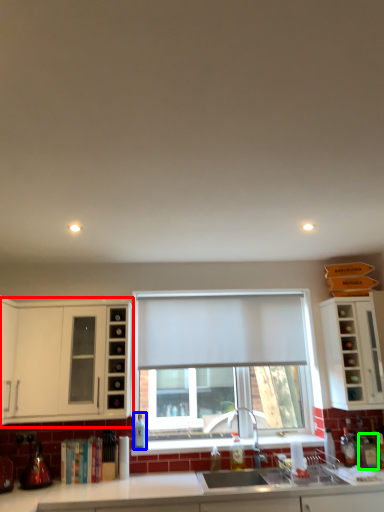
Question: Estimate the real-world distances between objects in this image. Which object is closer to cabinetry (highlighted by a red box), bottle (highlighted by a blue box) or bottle (highlighted by a green box)?

Choices:
 (A) bottle
 (B) bottle

Answer: (A)